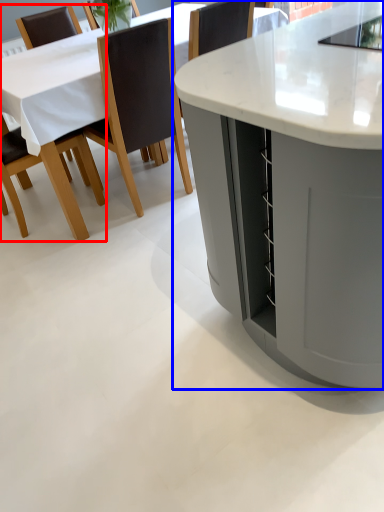
Question: Which point is closer to the camera, chair (highlighted by a red box) or table (highlighted by a blue box)?

Choices:
 (A) chair
 (B) table

Answer: (B)